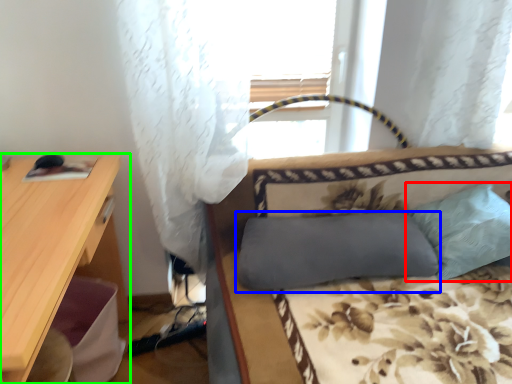
Question: Considering the real-world distances, which object is closest to pillow (highlighted by a red box)? pillow (highlighted by a blue box) or desk (highlighted by a green box).

Choices:
 (A) pillow
 (B) desk

Answer: (A)